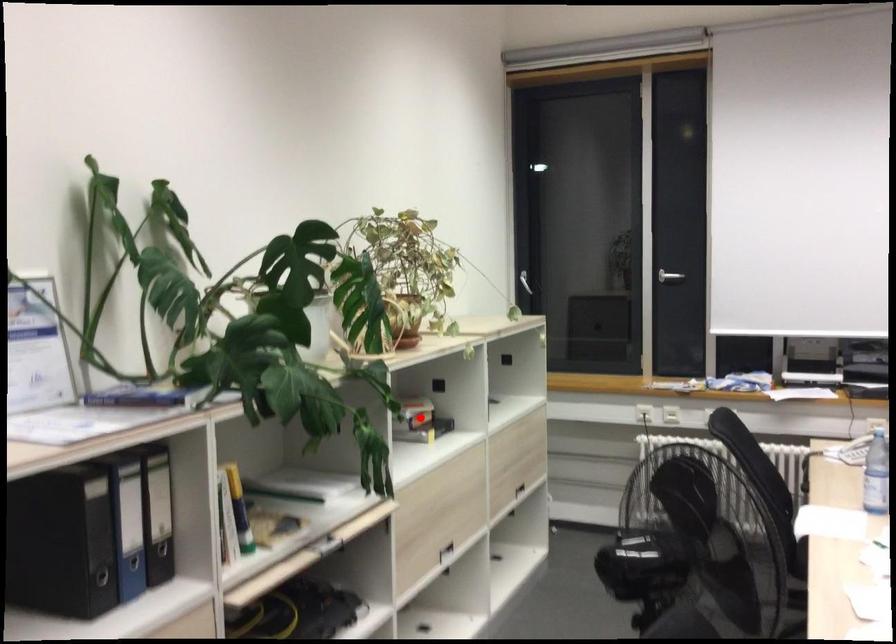
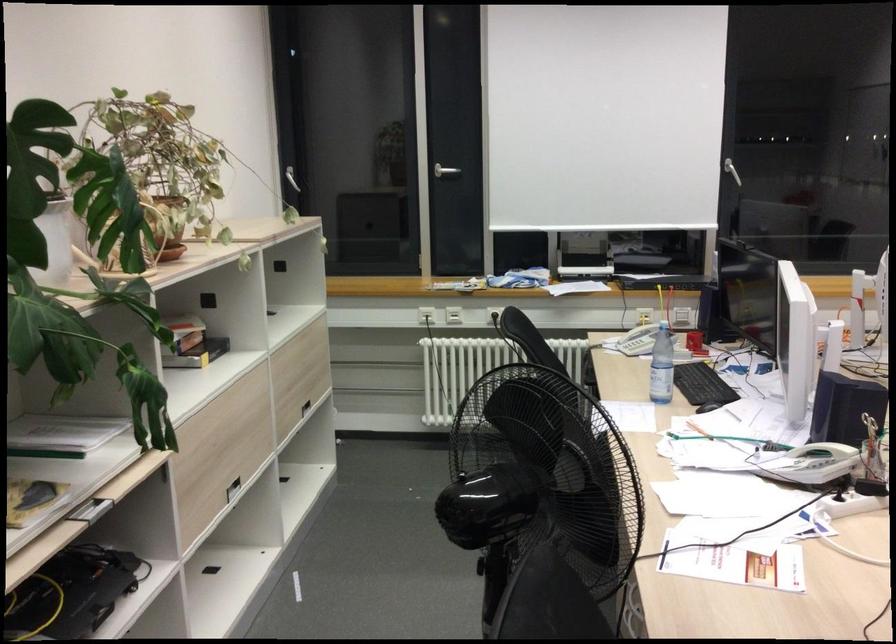
Question: I am providing you with two images of the same scene from different viewpoints. A red point is shown in image1. For the corresponding object point in image2, is it positioned nearer or farther from the camera?

Choices:
 (A) Nearer
 (B) Farther

Answer: (A)